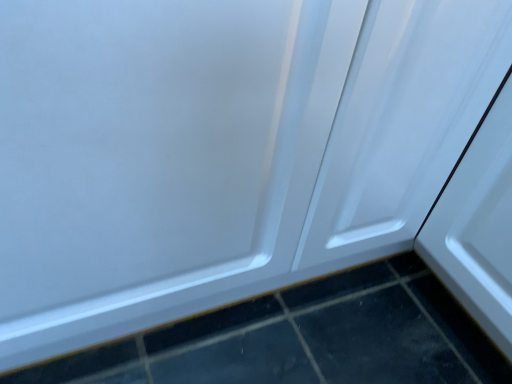
What do you see at coordinates (305, 338) in the screenshot? This screenshot has width=512, height=384. I see `black glossy tile at lower center` at bounding box center [305, 338].

Identify the location of black glossy tile at lower center. The width and height of the screenshot is (512, 384). (305, 338).

Identify the location of black glossy tile at lower center. (305, 338).